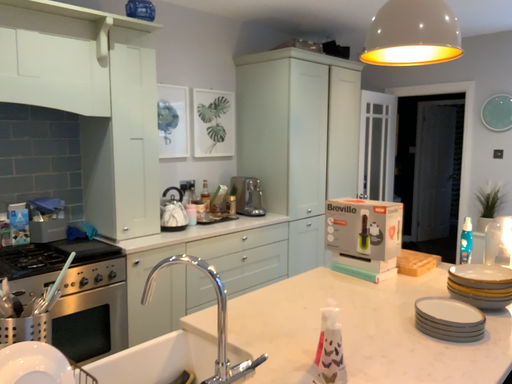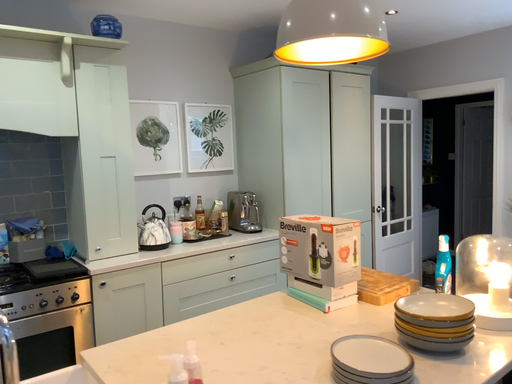
Question: Which way did the camera rotate in the video?

Choices:
 (A) rotated right
 (B) rotated left

Answer: (B)